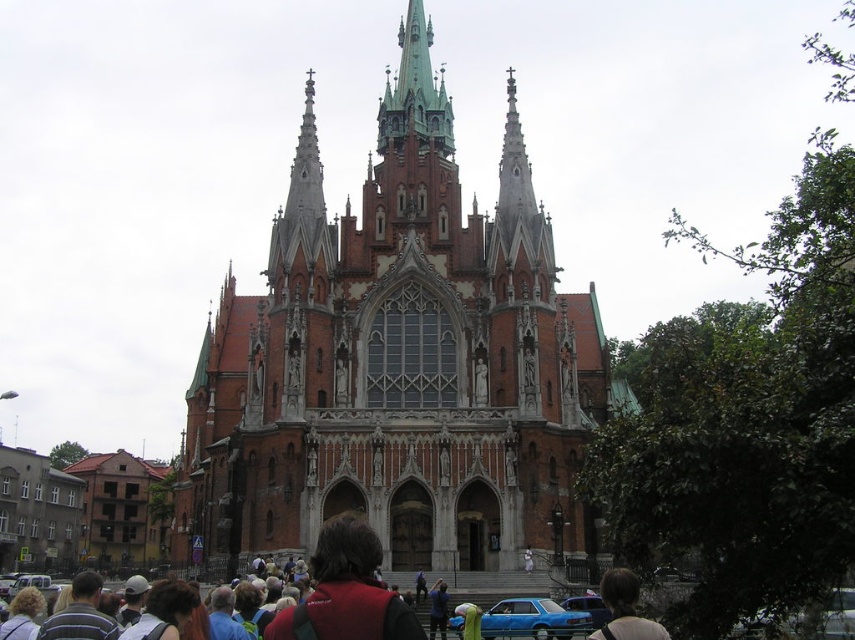
You are standing in front of the Gothic church and notice two objects at the center of the image. Which one is closer to you, the dark brown hair at center or the blue metallic car at center?

The dark brown hair at center is closer to you because it is positioned in front of the blue metallic car at center.

You are standing in front of the Gothic church and notice a person with dark brown hair at center. Where exactly is this person located in relation to the church?

The dark brown hair at center is located at point (624, 609) in the image.